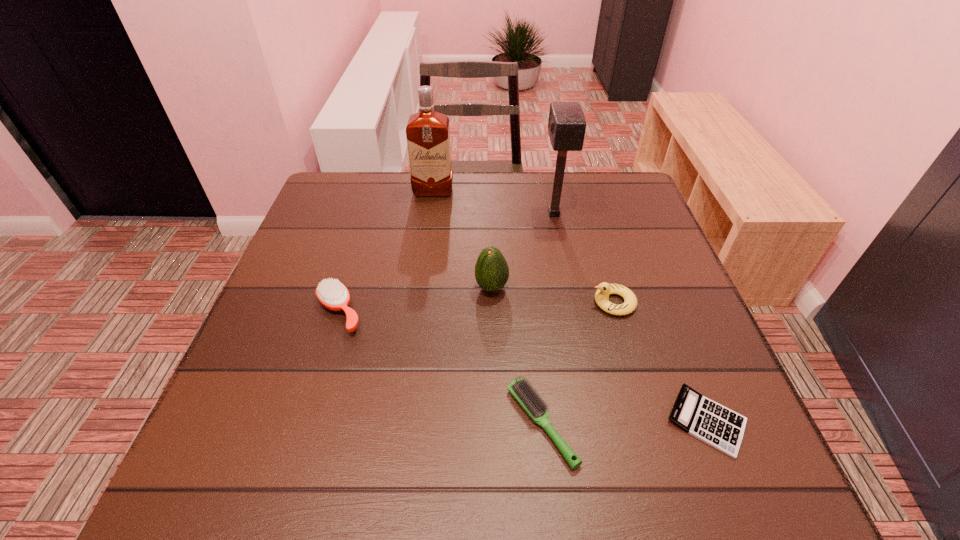
Find the location of a particular element. The width and height of the screenshot is (960, 540). free space between the farthest object and the shortest object is located at coordinates (570, 306).

Locate an element on the screen. The height and width of the screenshot is (540, 960). free spot between the second farthest object and the sixth tallest object is located at coordinates click(548, 319).

Locate an element on the screen. The image size is (960, 540). free space between the third object from right to left and the third tallest object is located at coordinates click(x=523, y=251).

Locate which object ranks in proximity to the avocado. Please provide its 2D coordinates. Your answer should be formatted as a tuple, i.e. [(x, y)], where the tuple contains the x and y coordinates of a point satisfying the conditions above.

[(604, 289)]

You are a GUI agent. You are given a task and a screenshot of the screen. Output one action in this format:
    pyautogui.click(x=<x>, y=<y>)
    Task: Click on the sixth closest object to the shorter hairbrush
    Image resolution: width=960 pixels, height=540 pixels.
    Given the screenshot: What is the action you would take?
    pyautogui.click(x=428, y=133)

You are a GUI agent. You are given a task and a screenshot of the screen. Output one action in this format:
    pyautogui.click(x=<x>, y=<y>)
    Task: Click on the free location that satisfies the following two spatial constraints: 1. on the front side of the shortest object; 2. on the left side of the third object from right to left
    The height and width of the screenshot is (540, 960).
    Given the screenshot: What is the action you would take?
    pyautogui.click(x=596, y=421)

Locate an element on the screen. The height and width of the screenshot is (540, 960). blank area in the image that satisfies the following two spatial constraints: 1. on the front label of the liquor; 2. on the left side of the shortest object is located at coordinates (402, 421).

I want to click on vacant space that satisfies the following two spatial constraints: 1. on the back side of the second farthest object; 2. on the left side of the shorter hairbrush, so 519,214.

Locate an element on the screen. The image size is (960, 540). vacant space that satisfies the following two spatial constraints: 1. on the face of the duckling; 2. on the front side of the farther hairbrush is located at coordinates (616, 312).